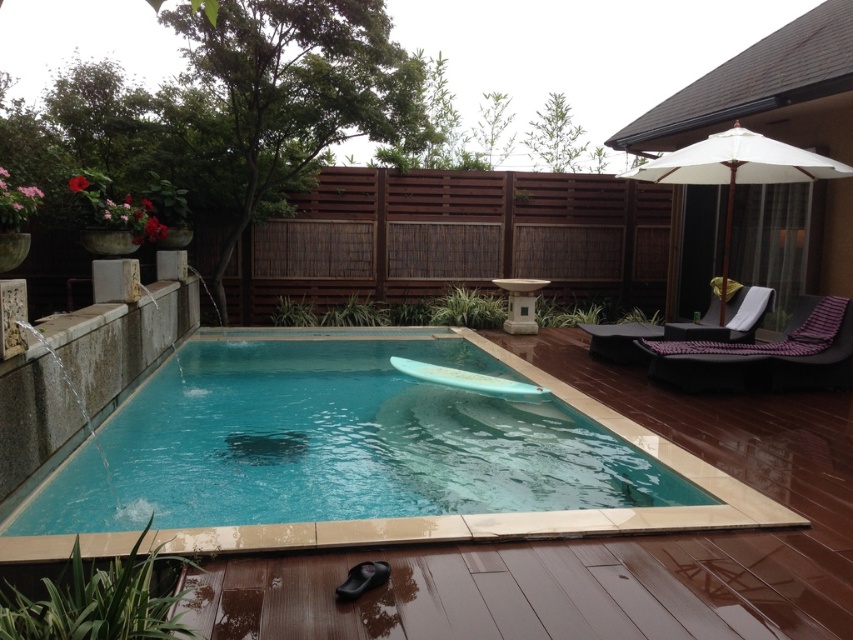
Which is below, purple fabric lounge chair at right or black fabric lounge chair at upper right?

Positioned lower is purple fabric lounge chair at right.

Is purple fabric lounge chair at right to the left of black fabric lounge chair at upper right from the viewer's perspective?

Incorrect, purple fabric lounge chair at right is not on the left side of black fabric lounge chair at upper right.

Between point (808, 353) and point (618, 339), which one is positioned in front?

Point (808, 353) is more forward.

You are a GUI agent. You are given a task and a screenshot of the screen. Output one action in this format:
    pyautogui.click(x=<x>, y=<y>)
    Task: Click on the purple fabric lounge chair at right
    
    Given the screenshot: What is the action you would take?
    pyautogui.click(x=764, y=355)

Does blue glossy surfboard at center appear on the left side of black fabric lounge chair at upper right?

Yes, blue glossy surfboard at center is to the left of black fabric lounge chair at upper right.

Who is more distant from viewer, (97, 452) or (733, 292)?

The point (733, 292) is behind.

This screenshot has height=640, width=853. I want to click on blue glossy surfboard at center, so click(337, 444).

Which is in front, point (668, 340) or point (759, 138)?

Point (759, 138)

Is point (650, 368) closer to viewer compared to point (689, 164)?

Yes, point (650, 368) is closer to viewer.

Does point (670, 368) come in front of point (751, 131)?

Yes.

Locate an element on the screen. Image resolution: width=853 pixels, height=640 pixels. purple fabric lounge chair at right is located at coordinates (764, 355).